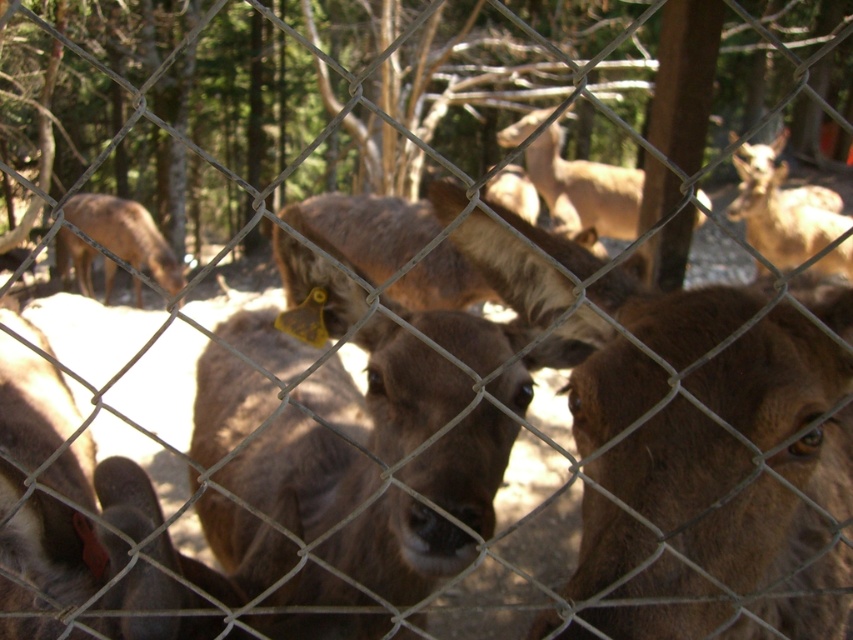
Question: From the image, what is the correct spatial relationship of brown furry deer at center in relation to brown fur deer at left?

Choices:
 (A) left
 (B) right

Answer: (B)

Question: Which object is positioned closest to the brown fur deer at left?

Choices:
 (A) brown fur deer at center
 (B) brown matte/deer at center
 (C) brown furry deer at center

Answer: (A)

Question: Which of the following is the closest to the observer?

Choices:
 (A) (494, 381)
 (B) (834, 212)
 (C) (840, 432)

Answer: (A)

Question: Does brown furry deer at center appear under brown fur deer at left?

Choices:
 (A) no
 (B) yes

Answer: (B)

Question: Is brown furry deer at center further to camera compared to brown fur deer at center?

Choices:
 (A) no
 (B) yes

Answer: (A)

Question: Which object is positioned farthest from the brown furry deer at center?

Choices:
 (A) brown matte/deer at center
 (B) brown fur deer at left

Answer: (B)